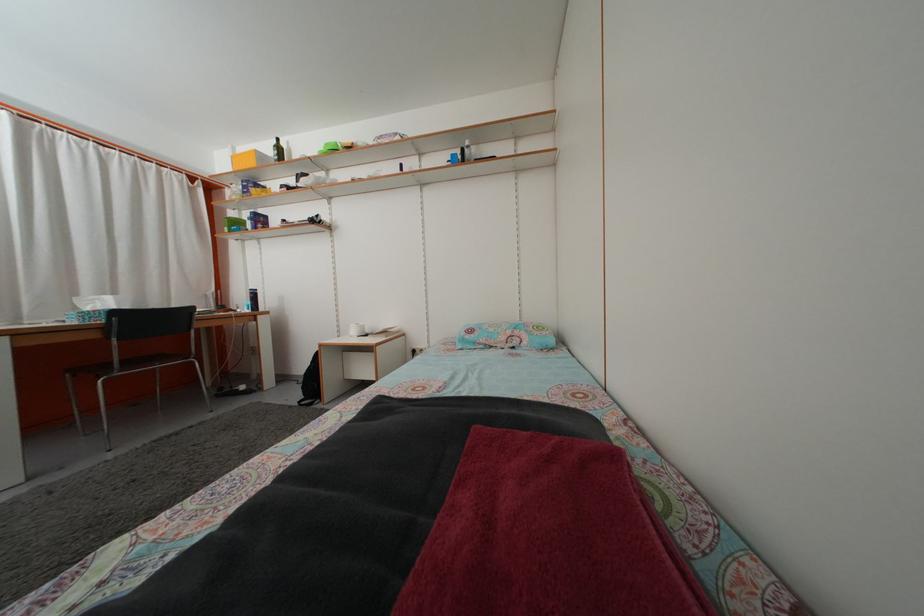
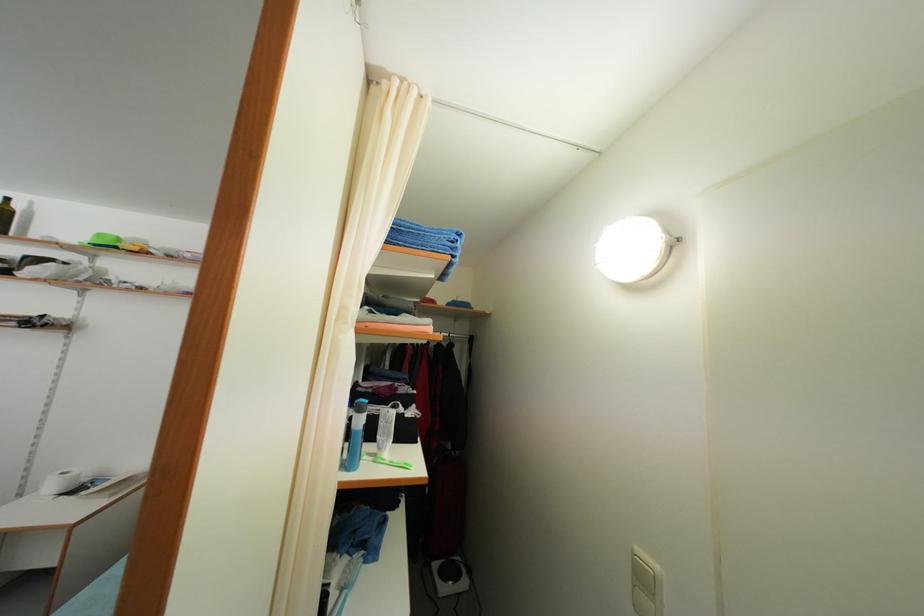
Which direction would the cameraman need to move to produce the second image?

The cameraman moved toward right, backward.